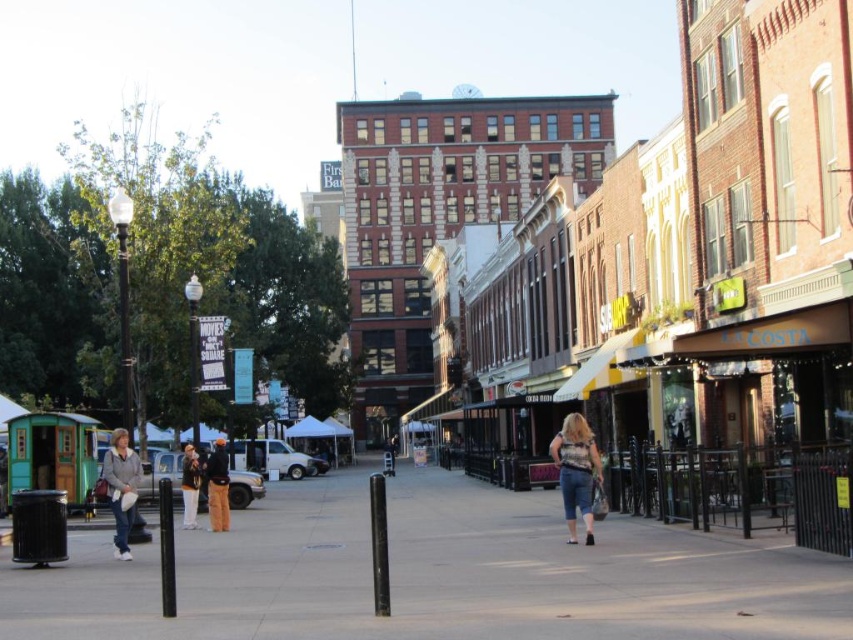
Which is more to the right, gray concrete sidewalk at center or light gray sweater at lower left?

gray concrete sidewalk at center

Who is lower down, gray concrete sidewalk at center or light gray sweater at lower left?

Positioned lower is gray concrete sidewalk at center.

Where is `gray concrete sidewalk at center`? The image size is (853, 640). gray concrete sidewalk at center is located at coordinates (433, 573).

Locate an element on the screen. gray concrete sidewalk at center is located at coordinates (433, 573).

Is denim shorts at center below orange fabric jacket at center?

Actually, denim shorts at center is above orange fabric jacket at center.

Is point (585, 451) closer to viewer compared to point (189, 477)?

Yes, it is.

Is point (585, 540) positioned before point (186, 522)?

Yes.

Find the location of a particular element. The width and height of the screenshot is (853, 640). denim shorts at center is located at coordinates coord(576,472).

Does denim shorts at center have a lesser height compared to black smooth pole at center?

Indeed, denim shorts at center has a lesser height compared to black smooth pole at center.

Is denim shorts at center bigger than black smooth pole at center?

No, denim shorts at center is not bigger than black smooth pole at center.

Find the location of `denim shorts at center`. denim shorts at center is located at coordinates (x=576, y=472).

Where is `denim shorts at center`? This screenshot has height=640, width=853. denim shorts at center is located at coordinates (576, 472).